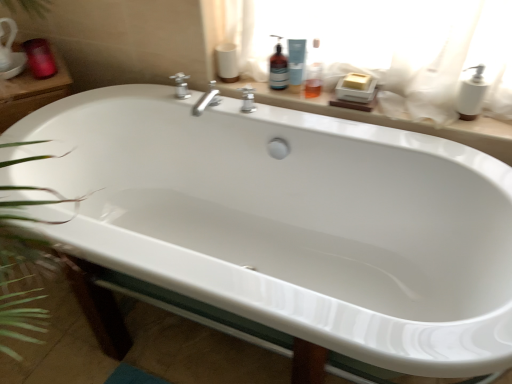
Question: From the image's perspective, relative to matte beige soap dish at upper center, is white matte toilet paper at upper center above or below?

Choices:
 (A) above
 (B) below

Answer: (A)

Question: Considering the positions of white matte toilet paper at upper center and matte beige soap dish at upper center in the image, is white matte toilet paper at upper center taller or shorter than matte beige soap dish at upper center?

Choices:
 (A) tall
 (B) short

Answer: (A)

Question: Which object is the closest to the translucent plastic bottle at upper center, placed as the 2th cleaning product when sorted from right to left?

Choices:
 (A) white plastic soap dispenser at upper right
 (B) matte beige soap dish at upper center
 (C) matte red candle at upper left
 (D) white matte toilet paper at upper center
 (E) blue plastic bottle at upper center, acting as the second cleaning product starting from the left

Answer: (E)

Question: Which object is the farthest from the translucent plastic bottle at upper center, acting as the 1th cleaning product starting from the left?

Choices:
 (A) white plastic soap dispenser at upper right
 (B) white matte toilet paper at upper center
 (C) blue plastic bottle at upper center, the first cleaning product in the right-to-left sequence
 (D) matte beige soap dish at upper center
 (E) matte red candle at upper left

Answer: (E)